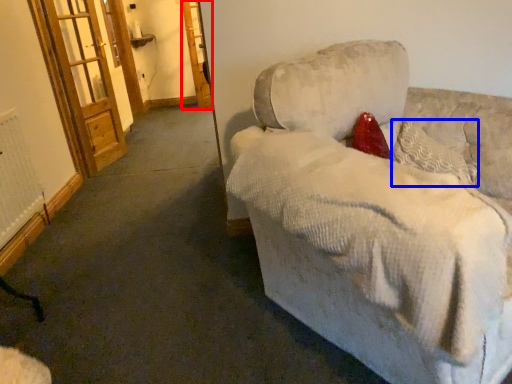
Question: Which point is further to the camera, screen door (highlighted by a red box) or pillow (highlighted by a blue box)?

Choices:
 (A) screen door
 (B) pillow

Answer: (A)